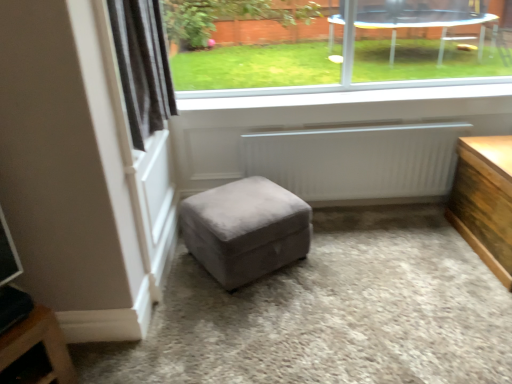
Question: From a real-world perspective, relative to suede gray ottoman at center, is transparent glass window at upper center vertically above or below?

Choices:
 (A) below
 (B) above

Answer: (B)

Question: In terms of width, does transparent glass window at upper center look wider or thinner when compared to suede gray ottoman at center?

Choices:
 (A) wide
 (B) thin

Answer: (B)

Question: Estimate the real-world distances between objects in this image. Which object is closer to the wooden table at right?

Choices:
 (A) transparent glass window at upper center
 (B) black velvet curtain at upper left
 (C) suede gray ottoman at center
 (D) white smooth window sill at upper center
 (E) white matte radiator at center

Answer: (E)

Question: Based on their relative distances, which object is nearer to the wooden table at right?

Choices:
 (A) black velvet curtain at upper left
 (B) white smooth window sill at upper center
 (C) suede gray ottoman at center
 (D) transparent glass window at upper center
 (E) white matte radiator at center

Answer: (E)